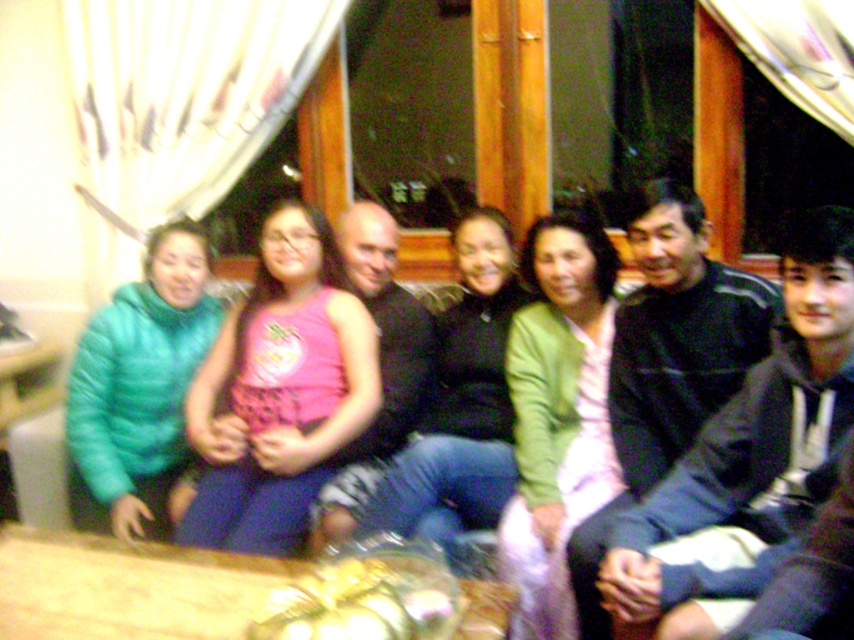
Can you confirm if matte green jacket at center is wider than wooden table at center?

Incorrect, matte green jacket at center's width does not surpass wooden table at center's.

Is point (840, 332) positioned behind point (129, 573)?

No, it is not.

Is point (668, 356) less distant than point (15, 634)?

No.

What are the coordinates of `matte green jacket at center` in the screenshot? It's located at (668, 417).

Does pink fabric dress at center appear on the left side of matte green jacket at center?

Correct, you'll find pink fabric dress at center to the left of matte green jacket at center.

Is pink fabric dress at center to the right of matte green jacket at center from the viewer's perspective?

Incorrect, pink fabric dress at center is not on the right side of matte green jacket at center.

The width and height of the screenshot is (854, 640). What do you see at coordinates (279, 392) in the screenshot? I see `pink fabric dress at center` at bounding box center [279, 392].

I want to click on pink fabric dress at center, so click(279, 392).

In the scene shown: Does wooden table at center have a smaller size compared to matte black sweater at center?

Yes, wooden table at center is smaller than matte black sweater at center.

Which is behind, point (279, 566) or point (439, 488)?

Positioned behind is point (439, 488).

Is point (168, 625) in front of point (455, 355)?

Yes, point (168, 625) is in front of point (455, 355).

The width and height of the screenshot is (854, 640). Find the location of `wooden table at center`. wooden table at center is located at coordinates (126, 588).